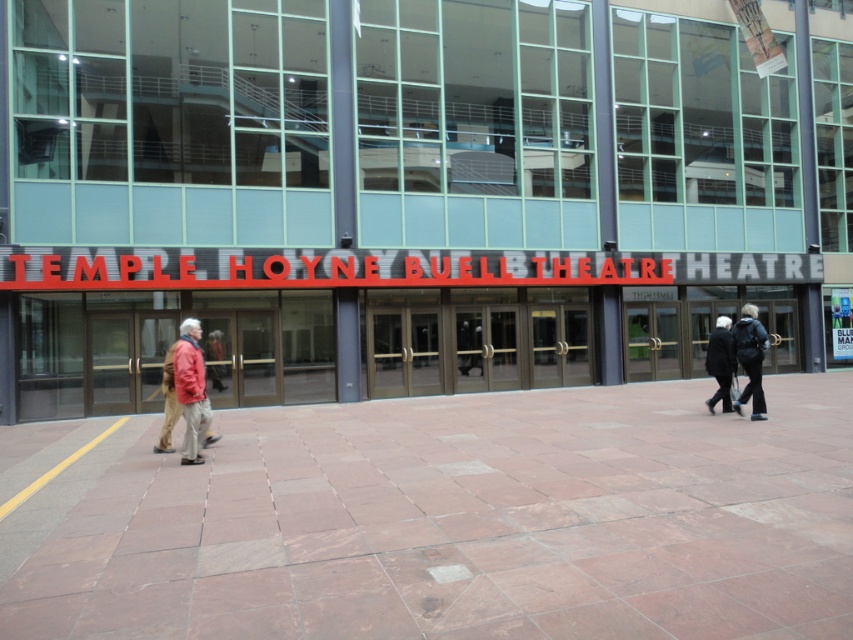
Who is lower down, red jacket at left or black wool coat at center?

red jacket at left is lower down.

Is red jacket at left bigger than black wool coat at center?

Yes.

Is point (196, 403) positioned after point (724, 378)?

That is False.

Where is `red jacket at left`? This screenshot has height=640, width=853. red jacket at left is located at coordinates (190, 388).

Is brown stone pavement at center taller than red jacket at left?

Incorrect, brown stone pavement at center's height is not larger of red jacket at left's.

Does brown stone pavement at center have a lesser height compared to red jacket at left?

Indeed, brown stone pavement at center has a lesser height compared to red jacket at left.

Describe the element at coordinates (456, 522) in the screenshot. The width and height of the screenshot is (853, 640). I see `brown stone pavement at center` at that location.

You are a GUI agent. You are given a task and a screenshot of the screen. Output one action in this format:
    pyautogui.click(x=<x>, y=<y>)
    Task: Click on the brown stone pavement at center
    The width and height of the screenshot is (853, 640).
    Given the screenshot: What is the action you would take?
    pyautogui.click(x=456, y=522)

Which is more to the right, red jacket at left or black leather jacket at center?

black leather jacket at center is more to the right.

Is point (177, 364) closer to camera compared to point (757, 369)?

Yes, it is in front of point (757, 369).

You are a GUI agent. You are given a task and a screenshot of the screen. Output one action in this format:
    pyautogui.click(x=<x>, y=<y>)
    Task: Click on the red jacket at left
    This screenshot has height=640, width=853.
    Given the screenshot: What is the action you would take?
    pyautogui.click(x=190, y=388)